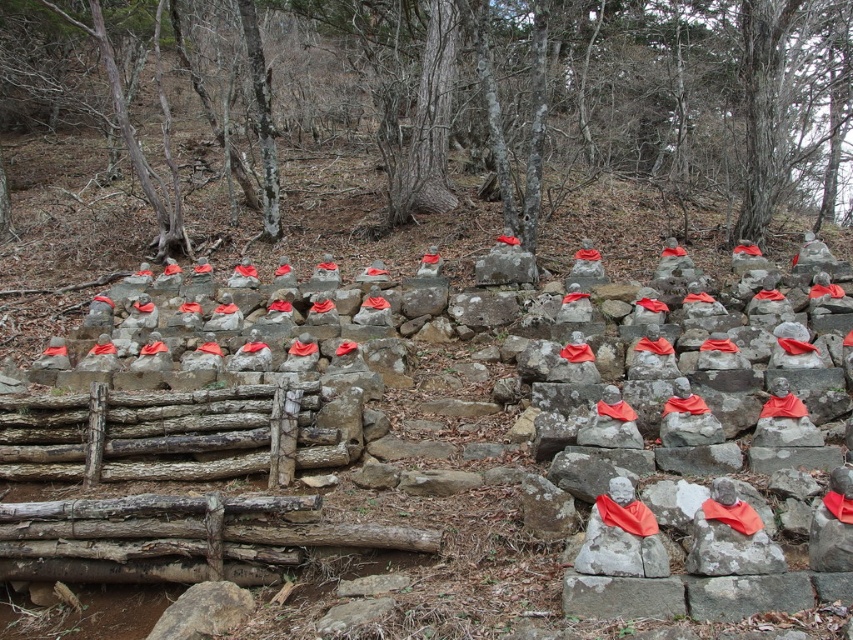
Does smooth gray statue at center have a lesser height compared to smooth gray rock at center?

No.

Can you confirm if smooth gray statue at center is thinner than smooth gray rock at center?

No.

Between point (318, 444) and point (711, 541), which one is positioned behind?

Positioned behind is point (318, 444).

Image resolution: width=853 pixels, height=640 pixels. Identify the location of smooth gray statue at center. (189, 401).

The width and height of the screenshot is (853, 640). I want to click on smooth gray statue at center, so click(x=189, y=401).

Does smooth gray statue at center appear under weathered wood at center?

Actually, smooth gray statue at center is above weathered wood at center.

Who is more distant from viewer, (276, 548) or (201, 396)?

The point (201, 396) is more distant.

Where is `smooth gray statue at center`? Image resolution: width=853 pixels, height=640 pixels. smooth gray statue at center is located at coordinates (189, 401).

Between weathered wood at center and smooth gray rock at center, which one is positioned lower?

smooth gray rock at center

Does point (120, 474) lie behind point (708, 548)?

Yes.

Who is more forward, (183,468) or (701,556)?

Positioned in front is point (701,556).

Locate an element on the screen. weathered wood at center is located at coordinates (167, 435).